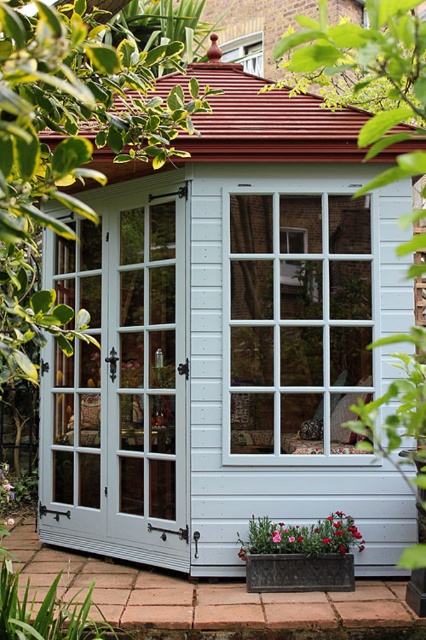
Question: Is white glass door at center positioned before pink fabric flower at lower center?

Choices:
 (A) yes
 (B) no

Answer: (B)

Question: Which of the following is the farthest from the observer?

Choices:
 (A) (255, 44)
 (B) (100, 244)
 (C) (273, 540)
 (D) (259, 241)

Answer: (A)

Question: Which object is the farthest from the pink fabric flower at center?

Choices:
 (A) pink fabric flower at lower center
 (B) matte white window at upper center
 (C) white wooden bay window at center
 (D) white glass door at center

Answer: (B)

Question: Which object appears farthest from the camera in this image?

Choices:
 (A) matte white window at upper center
 (B) white glass door at center
 (C) white wooden bay window at center

Answer: (A)

Question: In this image, where is matte white window at upper center located relative to pink fabric flower at center?

Choices:
 (A) below
 (B) above

Answer: (B)

Question: Is white glass door at center to the left of pink fabric flower at center from the viewer's perspective?

Choices:
 (A) yes
 (B) no

Answer: (A)